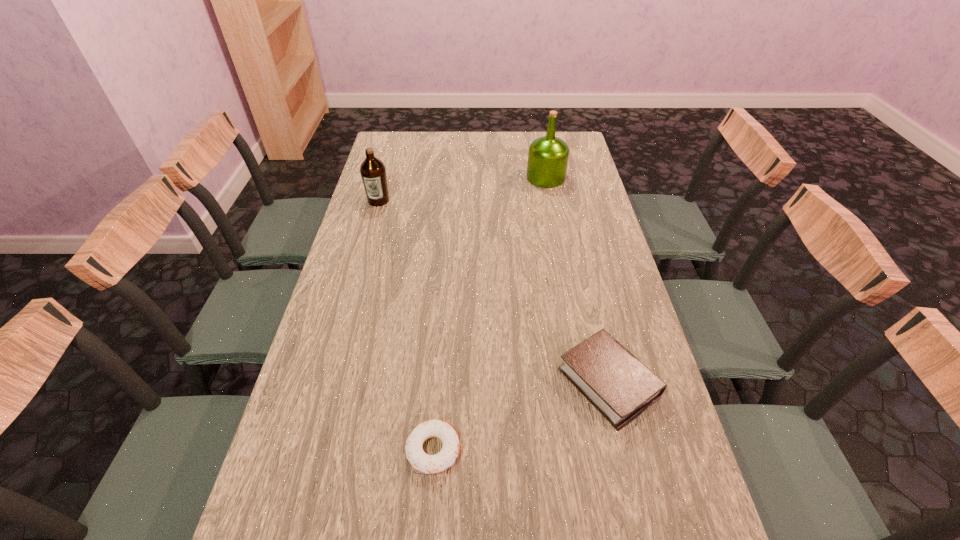
The height and width of the screenshot is (540, 960). I want to click on vacant area situated on the right of the shortest object, so click(x=639, y=450).

Identify the location of object positioned at the left edge. (373, 172).

I want to click on olive oil that is at the right edge, so click(548, 156).

I want to click on Bible situated at the right edge, so click(x=611, y=378).

Identify the location of free space at the left edge. The image size is (960, 540). (377, 308).

This screenshot has width=960, height=540. Identify the location of vacant space at the right edge. point(584,221).

The height and width of the screenshot is (540, 960). Find the location of `blank space at the far left corner of the desktop`. blank space at the far left corner of the desktop is located at coordinates (407, 143).

In order to click on vacant space at the far right corner of the desktop in this screenshot , I will do `click(565, 135)`.

This screenshot has width=960, height=540. In order to click on unoccupied position between the farthest object and the third tallest object in this screenshot , I will do `click(577, 280)`.

Locate an element on the screen. The width and height of the screenshot is (960, 540). unoccupied area between the farther olive oil and the third tallest object is located at coordinates coord(577,280).